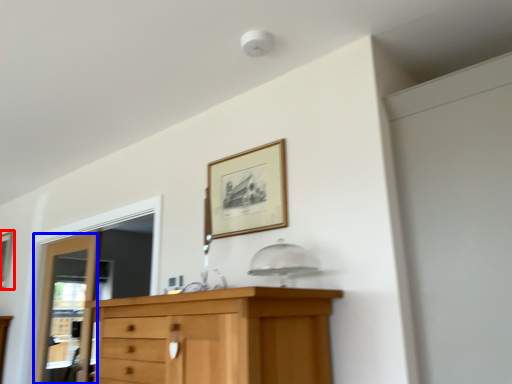
Question: Which point is closer to the camera, picture frame (highlighted by a red box) or door (highlighted by a blue box)?

Choices:
 (A) picture frame
 (B) door

Answer: (B)